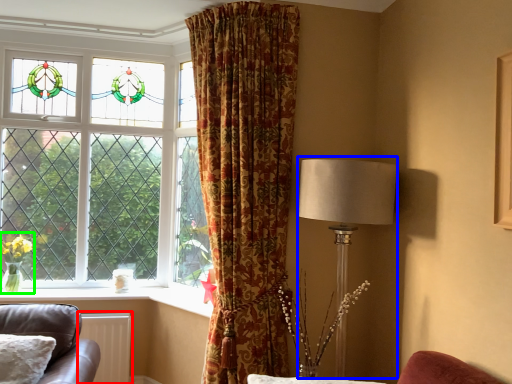
Question: Which is nearer to the radiator (highlighted by a red box)? table lamp (highlighted by a blue box) or floral arrangement (highlighted by a green box).

Choices:
 (A) table lamp
 (B) floral arrangement

Answer: (B)